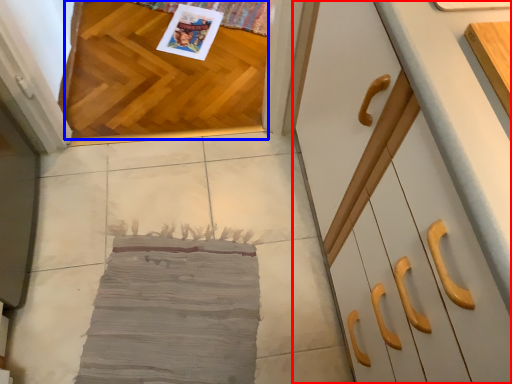
Question: Which object appears closest to the camera in this image, cabinetry (highlighted by a red box) or hardwood (highlighted by a blue box)?

Choices:
 (A) cabinetry
 (B) hardwood

Answer: (A)